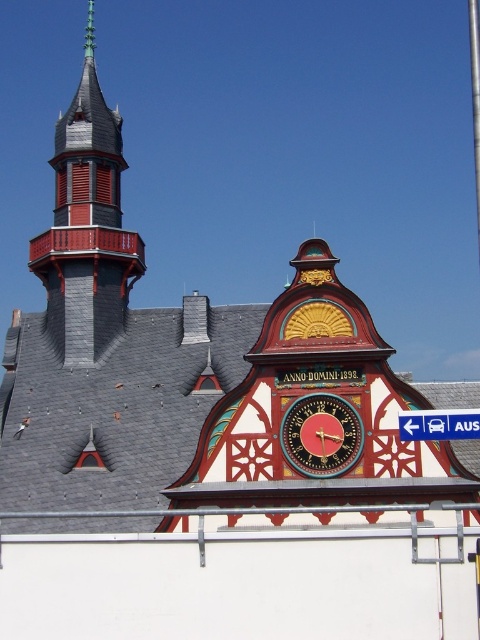
Question: Is wooden clock face at center positioned before blue plastic sign at upper right?

Choices:
 (A) no
 (B) yes

Answer: (A)

Question: Does wooden clock face at center have a lesser width compared to blue plastic sign at upper right?

Choices:
 (A) no
 (B) yes

Answer: (B)

Question: Is wooden clock face at center to the right of blue plastic sign at upper right from the viewer's perspective?

Choices:
 (A) yes
 (B) no

Answer: (B)

Question: Which of the following is the closest to the observer?

Choices:
 (A) wooden clock face at center
 (B) blue plastic sign at upper right

Answer: (B)